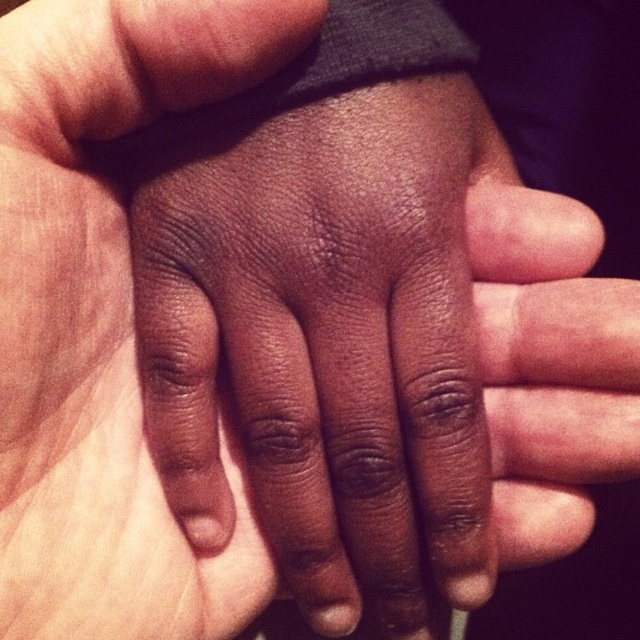
Question: Which of the following is the farthest from the observer?

Choices:
 (A) dry skin at center
 (B) dark skin palm at center

Answer: (A)

Question: Which of the following is the closest to the observer?

Choices:
 (A) dark skin palm at center
 (B) dry skin at center

Answer: (A)

Question: Can you confirm if dry skin at center is wider than dark skin palm at center?

Choices:
 (A) yes
 (B) no

Answer: (A)

Question: Does dry skin at center have a lesser width compared to dark skin palm at center?

Choices:
 (A) no
 (B) yes

Answer: (A)

Question: Which of the following is the farthest from the observer?

Choices:
 (A) dark skin palm at center
 (B) dry skin at center

Answer: (B)

Question: Can you confirm if dry skin at center is bigger than dark skin palm at center?

Choices:
 (A) yes
 (B) no

Answer: (A)